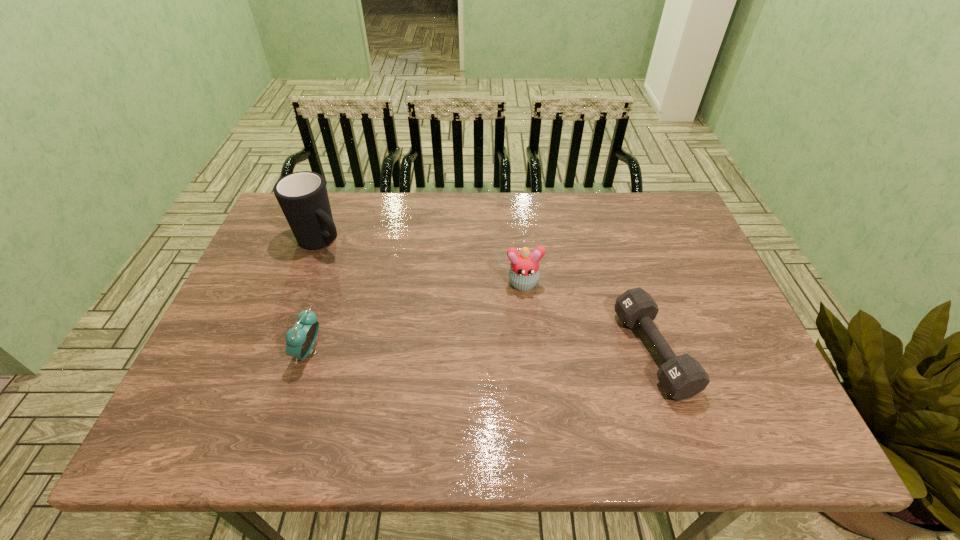
Find the location of a particular element. The image size is (960, 540). vacant spot on the desktop that is between the alarm clock and the dumbbell and is positioned on the side of the mug with the handle is located at coordinates (463, 352).

The height and width of the screenshot is (540, 960). What are the coordinates of `free spot on the desktop that is between the alarm clock and the rightmost object and is positioned on the face of the third object from left to right` in the screenshot? It's located at (531, 352).